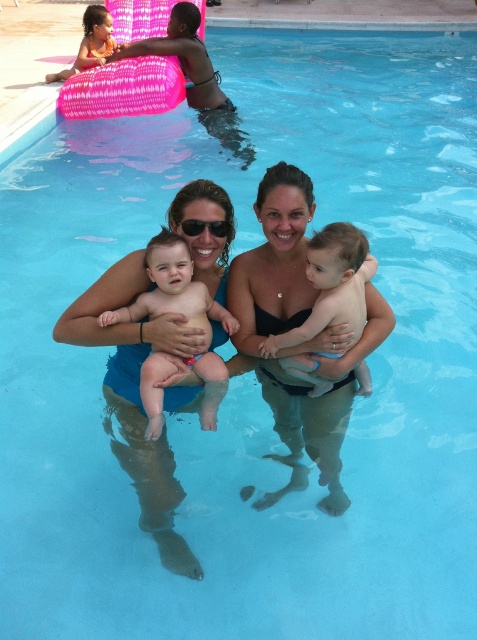
You are a photographer taking a picture of the blue fabric at center and the smooth skin baby at center. Which object should you focus on first if you want to ensure both are in focus?

The blue fabric at center is bigger than the smooth skin baby at center, so you should focus on the blue fabric at center first to ensure both are in focus.

You are a photographer at the pool and want to take a photo of the blue fabric at center and the smooth skin baby at center. Which object is positioned to the left of the other?

The blue fabric at center is to the left of smooth skin baby at center.